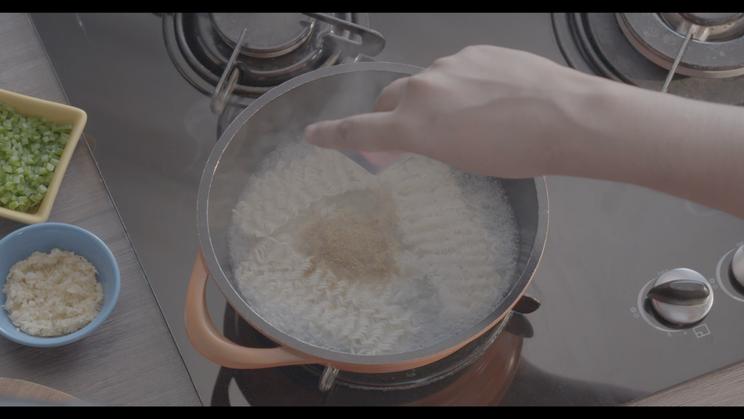
Identify the location of burners. (275, 19), (716, 28).